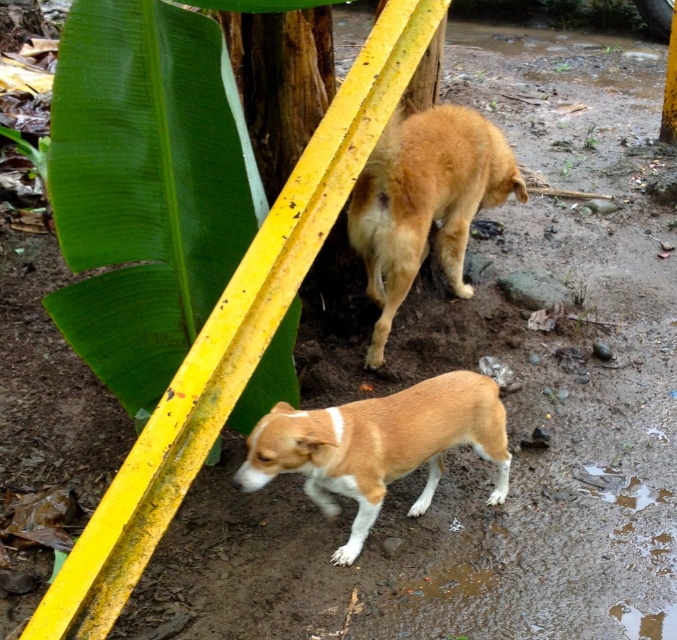
You are standing at the point marked by coordinates (378, 445) in the image. Looking around, you see a large banana leaf and a yellow metal fence structure. Which object is closer to your current position?

The brown fur dog at center is exactly at the marked point, so it is the closest object to your current position.

You are standing at the point labeled point (397, 268) and want to walk to the point labeled point (353, 410). Given the muddy ground, which direction should you move relative to your current position?

You should move forward because point (353, 410) is in front of point (397, 268).

You are a photographer trying to capture both the brown fur dog at center and the brown furry dog at center in a single shot. Since you want to ensure both are clearly visible, which dog should you focus on first to account for their size difference?

The brown fur dog at center is smaller than the brown furry dog at center, so you should focus on the brown furry dog at center first to ensure its details are sharp before adjusting for the smaller one.